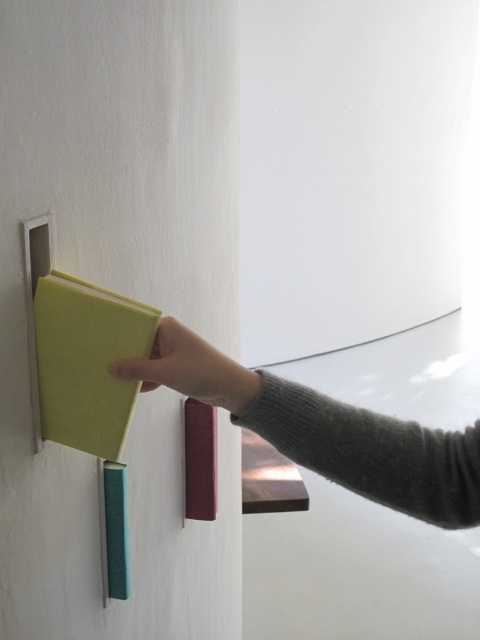
You are trying to place a new book into the niche. The niche has two marked points for alignment. The first point is at coordinates point (157, 380) and the second is at point (252, 394). Which point is closer to you when standing in front of the niche?

Point (157, 380) is closer to the viewer than point (252, 394), so the first point is closer.

You are trying to place a new book in the niche. The point at the center of the niche is at coordinates point (x=324, y=429). Where is the gray wool sweater in relation to the center of the niche?

The gray wool sweater at upper center is located at the point (x=324, y=429), which is the center of the niche.

You are organizing books on a shelf and notice the gray wool sweater at upper center and the matte green book at center. Which object is positioned lower in the image?

The gray wool sweater at upper center is located below the matte green book at center, so it is positioned lower.